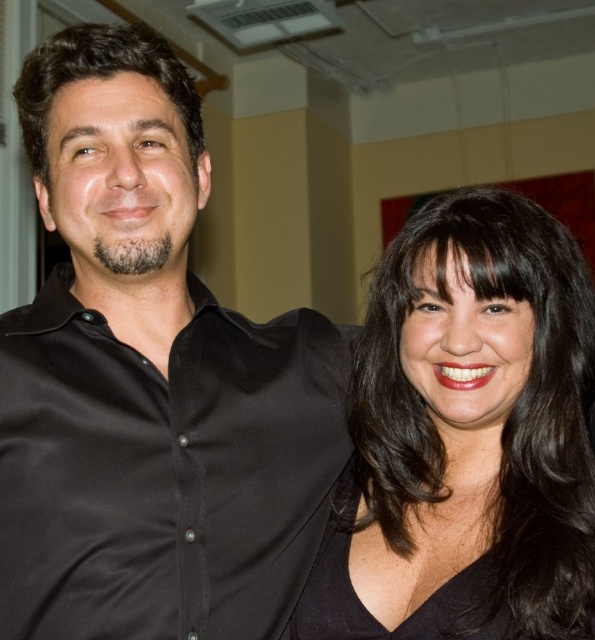
Does matte black shirt at center have a smaller size compared to black matte hair at right?

No, matte black shirt at center is not smaller than black matte hair at right.

Does matte black shirt at center have a larger size compared to black matte hair at right?

Yes, matte black shirt at center is bigger than black matte hair at right.

Who is more forward, [139,189] or [512,204]?

Point [139,189] is in front.

At what (x,y) coordinates should I click in order to perform the action: click on matte black shirt at center. Please return your answer as a coordinate pair (x, y). The height and width of the screenshot is (640, 595). Looking at the image, I should click on (148, 380).